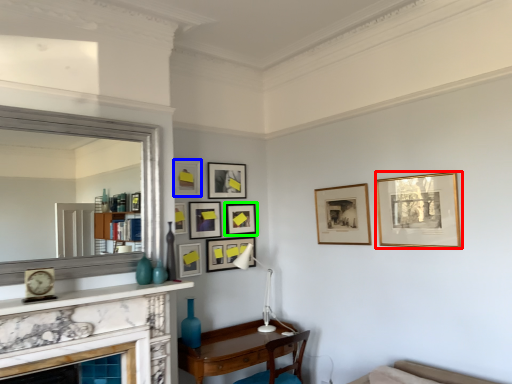
Question: Which object is positioned farthest from picture frame (highlighted by a red box)? Select from picture frame (highlighted by a blue box) and picture frame (highlighted by a green box).

Choices:
 (A) picture frame
 (B) picture frame

Answer: (A)